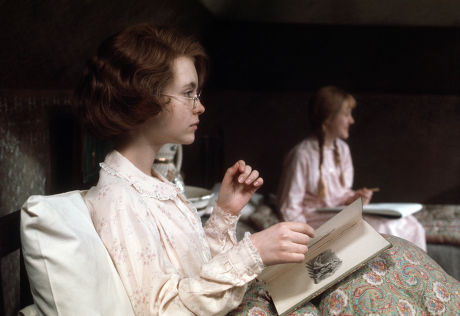
This screenshot has height=316, width=460. What are the coordinates of `blanket` in the screenshot? It's located at (387, 284), (405, 269), (256, 306).